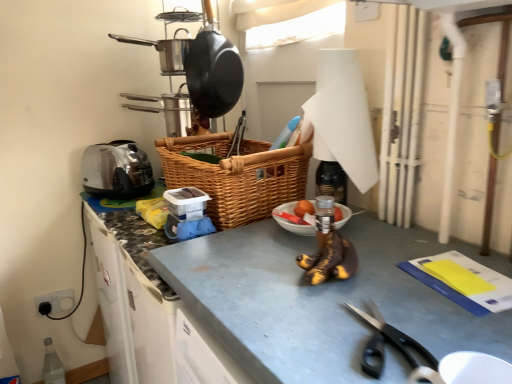
What do you see at coordinates (331, 298) in the screenshot?
I see `smooth gray countertop at center` at bounding box center [331, 298].

Describe the element at coordinates (213, 70) in the screenshot. I see `matte black frying pan at upper center, which appears as the first frying pan when viewed from the right` at that location.

How much space does shiny black frying pan at upper center, which appears as the first frying pan when viewed from the left, occupy vertically?

It is 5.44 inches.

Identify the location of smooth gray countertop at center. (331, 298).

From the image's perspective, which one is positioned higher, transparent plastic bottle at lower left or satin silver toaster at left?

From the image's view, satin silver toaster at left is above.

Between transparent plastic bottle at lower left and satin silver toaster at left, which one has less height?

With less height is satin silver toaster at left.

Who is bigger, transparent plastic bottle at lower left or satin silver toaster at left?

With larger size is satin silver toaster at left.

Which object is further away from the camera taking this photo, transparent plastic bottle at lower left or satin silver toaster at left?

transparent plastic bottle at lower left is further away from the camera.

Which is more to the right, transparent plastic bottle at lower left or smooth gray countertop at center?

smooth gray countertop at center.

Can you see transparent plastic bottle at lower left touching smooth gray countertop at center?

No.

In the scene shown: How distant is transparent plastic bottle at lower left from smooth gray countertop at center?

transparent plastic bottle at lower left is 4.63 feet away from smooth gray countertop at center.

Is transparent plastic bottle at lower left positioned beyond the bounds of smooth gray countertop at center?

Yes, transparent plastic bottle at lower left is located beyond the bounds of smooth gray countertop at center.

How many degrees apart are the facing directions of white paper towel at upper center and black plastic scissors at lower right?

There is a 20.9-degree angle between the facing directions of white paper towel at upper center and black plastic scissors at lower right.

Is white paper towel at upper center oriented towards black plastic scissors at lower right?

No, white paper towel at upper center does not turn towards black plastic scissors at lower right.

At what (x,y) coordinates should I click in order to perform the action: click on scissors below the white paper towel at upper center (from the image's perspective). Please return your answer as a coordinate pair (x, y). This screenshot has height=384, width=512. Looking at the image, I should click on (395, 336).

From a real-world perspective, is white paper towel at upper center positioned under black plastic scissors at lower right based on gravity?

No, from a real-world perspective, white paper towel at upper center is not under black plastic scissors at lower right.

Which point is more distant from viewer, (208,65) or (297,182)?

Point (208,65)

Can you confirm if matte black frying pan at upper center, which appears as the second frying pan when viewed from the left, is smaller than woven brown picnic basket at center?

Yes.

From a real-world perspective, who is located higher, matte black frying pan at upper center, which appears as the first frying pan when viewed from the right, or woven brown picnic basket at center?

matte black frying pan at upper center, which appears as the first frying pan when viewed from the right.

From a real-world perspective, is black plastic scissors at lower right under white paper towel at upper center?

Yes, from a real-world perspective, black plastic scissors at lower right is below white paper towel at upper center.

Considering the relative positions of black plastic scissors at lower right and white paper towel at upper center in the image provided, is black plastic scissors at lower right to the left or to the right of white paper towel at upper center?

black plastic scissors at lower right is positioned on white paper towel at upper center's left side.

Does black plastic scissors at lower right have a greater height compared to white paper towel at upper center?

In fact, black plastic scissors at lower right may be shorter than white paper towel at upper center.

Considering the positions of point (370, 316) and point (340, 69), is point (370, 316) closer or farther from the camera than point (340, 69)?

Point (370, 316) appears to be closer to the viewer than point (340, 69).

From the image's perspective, which is below, shiny black frying pan at upper center, which appears as the first frying pan when viewed from the left, or smooth gray countertop at center?

smooth gray countertop at center appears lower in the image.

Is shiny black frying pan at upper center, which appears as the first frying pan when viewed from the left, oriented towards smooth gray countertop at center?

No, shiny black frying pan at upper center, which appears as the first frying pan when viewed from the left, is not oriented towards smooth gray countertop at center.

Is the depth of shiny black frying pan at upper center, which appears as the first frying pan when viewed from the left, less than that of smooth gray countertop at center?

No, shiny black frying pan at upper center, which appears as the first frying pan when viewed from the left, is behind smooth gray countertop at center.

Considering the sizes of objects shiny black frying pan at upper center, the second frying pan from the right, and smooth gray countertop at center in the image provided, who is wider, shiny black frying pan at upper center, the second frying pan from the right, or smooth gray countertop at center?

smooth gray countertop at center is wider.

Is white paper towel at upper center a part of satin silver toaster at left?

Definitely not — white paper towel at upper center is not inside satin silver toaster at left.

Is satin silver toaster at left behind white paper towel at upper center?

Yes, it is.

I want to click on appliance below the white paper towel at upper center (from a real-world perspective), so click(116, 170).

Identify the location of appliance on the right of transparent plastic bottle at lower left. The image size is (512, 384). (116, 170).

This screenshot has width=512, height=384. I want to click on bottle behind the smooth gray countertop at center, so click(52, 365).

When comparing their distances from satin silver toaster at left, does woven brown picnic basket at center or smooth gray countertop at center seem closer?

The object closer to satin silver toaster at left is woven brown picnic basket at center.

Based on the photo, estimate the real-world distances between objects in this image. Which object is further from satin silver toaster at left, matte black frying pan at upper center, which appears as the first frying pan when viewed from the right, or white paper towel at upper center?

white paper towel at upper center is further to satin silver toaster at left.

Based on their spatial positions, is smooth gray countertop at center or woven brown picnic basket at center closer to transparent plastic bottle at lower left?

woven brown picnic basket at center lies closer to transparent plastic bottle at lower left than the other object.

From the image, which object appears to be farther from smooth gray countertop at center, black plastic scissors at lower right or satin silver toaster at left?

satin silver toaster at left.

When comparing their distances from black plastic scissors at lower right, does woven brown picnic basket at center or shiny black frying pan at upper center, the second frying pan from the right, seem closer?

woven brown picnic basket at center lies closer to black plastic scissors at lower right than the other object.

Considering their positions, is transparent plastic bottle at lower left positioned closer to smooth gray countertop at center than white paper towel at upper center?

The object closer to smooth gray countertop at center is white paper towel at upper center.

Estimate the real-world distances between objects in this image. Which object is further from satin silver toaster at left, transparent plastic bottle at lower left or white paper towel at upper center?

Among the two, transparent plastic bottle at lower left is located further to satin silver toaster at left.

Looking at the image, which one is located further to transparent plastic bottle at lower left, satin silver toaster at left or woven brown picnic basket at center?

Among the two, woven brown picnic basket at center is located further to transparent plastic bottle at lower left.

Image resolution: width=512 pixels, height=384 pixels. What are the coordinates of `picnic basket located between transparent plastic bottle at lower left and white paper towel at upper center in the left-right direction` in the screenshot? It's located at (236, 175).

The width and height of the screenshot is (512, 384). I want to click on picnic basket positioned between black plastic scissors at lower right and matte black frying pan at upper center, which appears as the second frying pan when viewed from the left, from near to far, so pos(236,175).

Find the location of a particular element. paper towel located between smooth gray countertop at center and transparent plastic bottle at lower left in the depth direction is located at coordinates (342, 117).

Find the location of a particular element. The height and width of the screenshot is (384, 512). paper towel between matte black frying pan at upper center, which appears as the first frying pan when viewed from the right, and smooth gray countertop at center vertically is located at coordinates (342, 117).